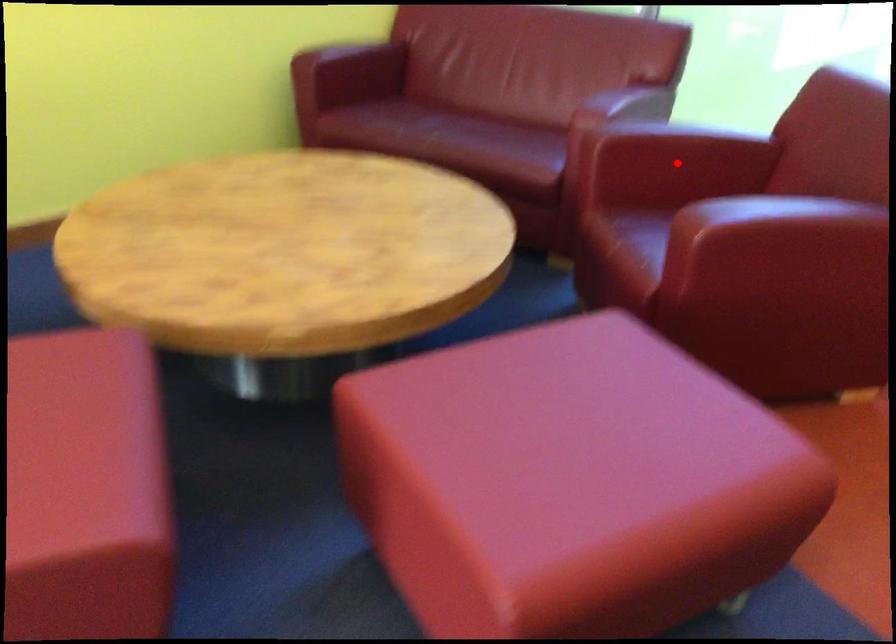
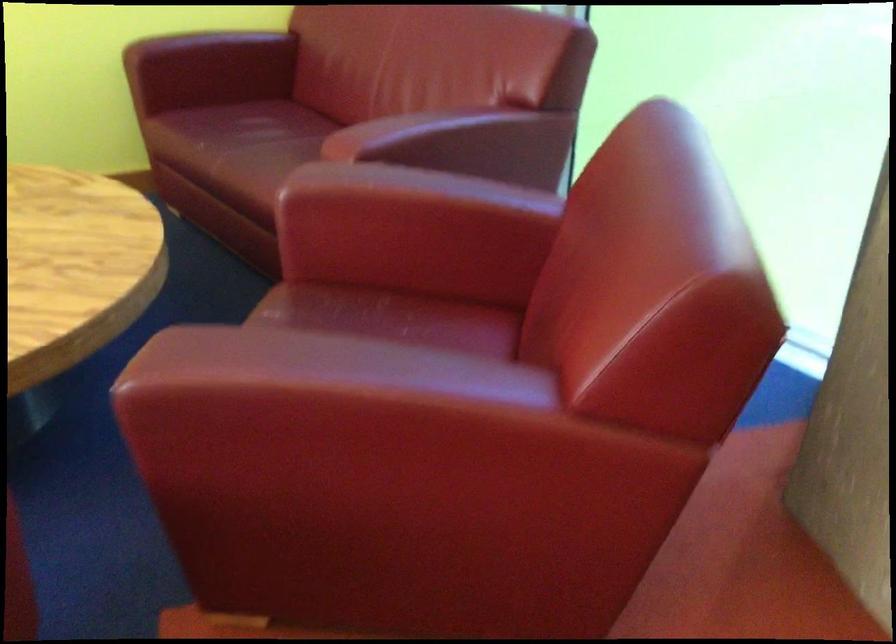
In the second image, find the point that corresponds to the highlighted location in the first image.

(412, 231)